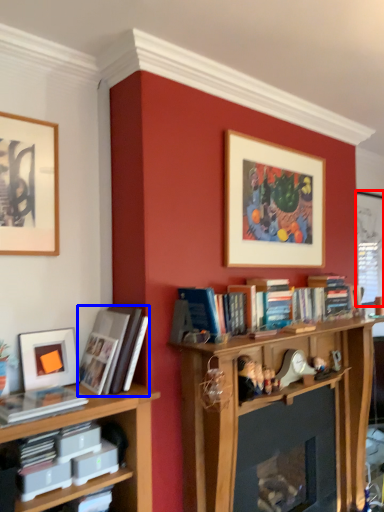
Question: Which point is closer to the camera, window screen (highlighted by a red box) or book (highlighted by a blue box)?

Choices:
 (A) window screen
 (B) book

Answer: (B)